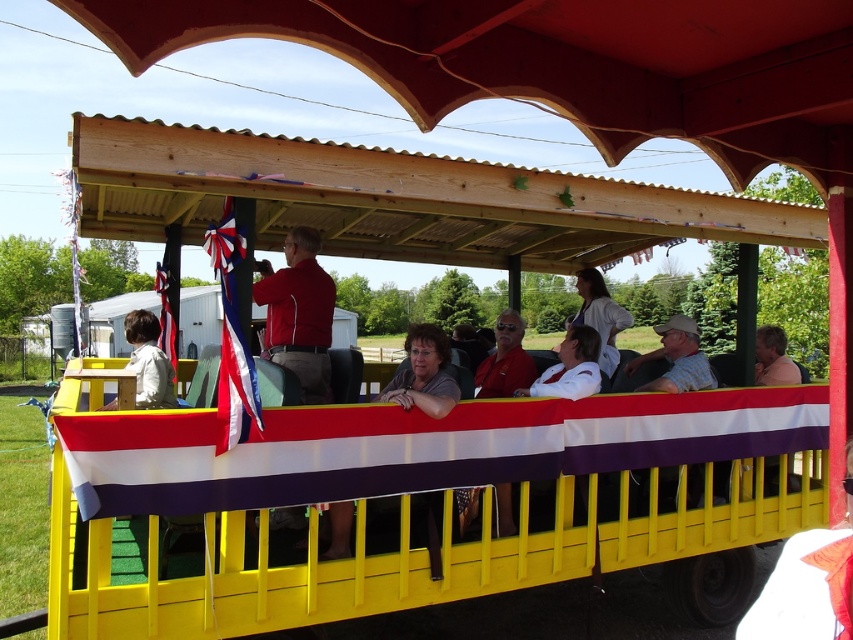
Does red-white-blue fabric flag at left have a greater width compared to red fabric flag at left?

No, red-white-blue fabric flag at left is not wider than red fabric flag at left.

Who is more forward, (228, 426) or (171, 333)?

Point (228, 426) is in front.

The image size is (853, 640). Describe the element at coordinates (231, 337) in the screenshot. I see `red-white-blue fabric flag at left` at that location.

Where is `red-white-blue fabric flag at left`? This screenshot has height=640, width=853. red-white-blue fabric flag at left is located at coordinates (231, 337).

Which is more to the right, orange fabric at lower right or red smooth jacket at center?

orange fabric at lower right is more to the right.

The image size is (853, 640). I want to click on orange fabric at lower right, so click(808, 582).

Is point (792, 632) less distant than point (689, 372)?

Yes, it is in front of point (689, 372).

Image resolution: width=853 pixels, height=640 pixels. What do you see at coordinates (808, 582) in the screenshot? I see `orange fabric at lower right` at bounding box center [808, 582].

Locate an element on the screen. This screenshot has height=640, width=853. orange fabric at lower right is located at coordinates (808, 582).